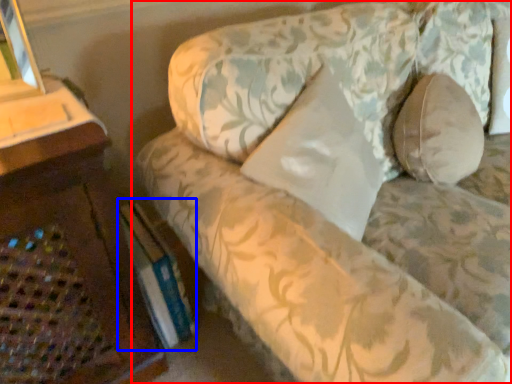
Question: Which object is closer to the camera taking this photo, studio couch (highlighted by a red box) or paperback book (highlighted by a blue box)?

Choices:
 (A) studio couch
 (B) paperback book

Answer: (A)